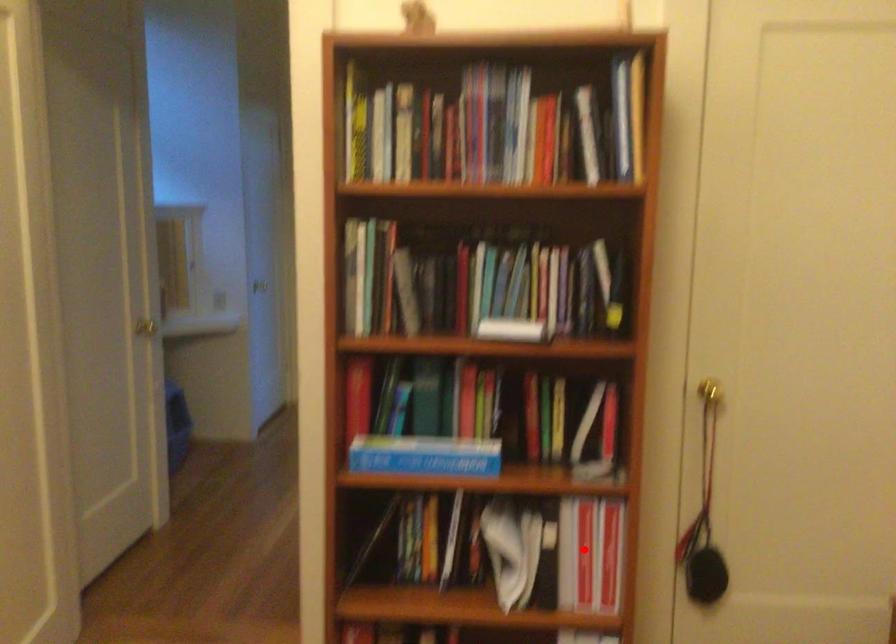
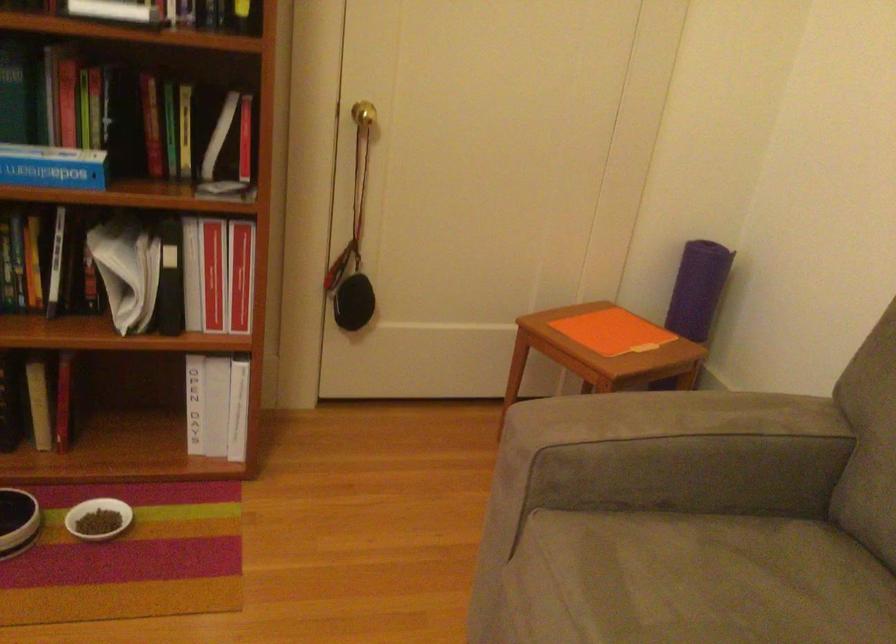
Question: I am providing you with two images of the same scene from different viewpoints. A red point is shown in image1. For the corresponding object point in image2, is it positioned nearer or farther from the camera?

Choices:
 (A) Nearer
 (B) Farther

Answer: (A)